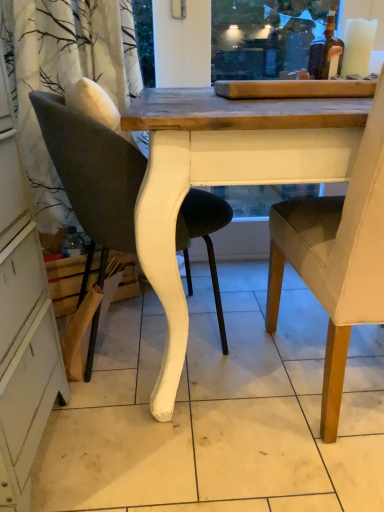
Image resolution: width=384 pixels, height=512 pixels. Describe the element at coordinates (93, 176) in the screenshot. I see `white painted wood chair at left, which is the 1th chair in left-to-right order` at that location.

What is the approximate height of white painted wood chair at left, which is the 1th chair in left-to-right order?

white painted wood chair at left, which is the 1th chair in left-to-right order, is 34.23 inches in height.

At what (x,y) coordinates should I click in order to perform the action: click on white painted wood chair at left, which is the 1th chair in left-to-right order. Please return your answer as a coordinate pair (x, y). Image resolution: width=384 pixels, height=512 pixels. Looking at the image, I should click on (93, 176).

In order to face light brown fabric chair at right, the 2th chair in the left-to-right sequence, should I rotate leftwards or rightwards?

Rotate your view right by about 23.432°.

This screenshot has height=512, width=384. I want to click on light brown fabric chair at right, which is the 1th chair in right-to-left order, so (337, 256).

What do you see at coordinates (337, 256) in the screenshot? Image resolution: width=384 pixels, height=512 pixels. I see `light brown fabric chair at right, which is the 1th chair in right-to-left order` at bounding box center [337, 256].

I want to click on white painted wood chair at left, which is the 1th chair in left-to-right order, so click(x=93, y=176).

Is light brown fabric chair at right, which is the 1th chair in right-to-left order, to the left of white painted wood chair at left, the 2th chair viewed from the right, from the viewer's perspective?

No, light brown fabric chair at right, which is the 1th chair in right-to-left order, is not to the left of white painted wood chair at left, the 2th chair viewed from the right.

In the scene shown: Between light brown fabric chair at right, which is the 1th chair in right-to-left order, and white painted wood chair at left, the 2th chair viewed from the right, which one is positioned behind?

white painted wood chair at left, the 2th chair viewed from the right, is more distant.

Between point (376, 159) and point (114, 145), which one is positioned behind?

The point (114, 145) is behind.

From the image's perspective, would you say light brown fabric chair at right, the 2th chair in the left-to-right sequence, is shown under white painted wood chair at left, the 2th chair viewed from the right?

Yes, from the image's perspective, light brown fabric chair at right, the 2th chair in the left-to-right sequence, is below white painted wood chair at left, the 2th chair viewed from the right.

From a real-world perspective, is light brown fabric chair at right, the 2th chair in the left-to-right sequence, on top of white painted wood chair at left, the 2th chair viewed from the right?

Yes.

Is light brown fabric chair at right, the 2th chair in the left-to-right sequence, thinner than white painted wood chair at left, which is the 1th chair in left-to-right order?

No.

Can you confirm if light brown fabric chair at right, which is the 1th chair in right-to-left order, is shorter than white painted wood chair at left, the 2th chair viewed from the right?

No, light brown fabric chair at right, which is the 1th chair in right-to-left order, is not shorter than white painted wood chair at left, the 2th chair viewed from the right.

Considering the sizes of objects light brown fabric chair at right, which is the 1th chair in right-to-left order, and white painted wood chair at left, which is the 1th chair in left-to-right order, in the image provided, who is smaller, light brown fabric chair at right, which is the 1th chair in right-to-left order, or white painted wood chair at left, which is the 1th chair in left-to-right order,?

white painted wood chair at left, which is the 1th chair in left-to-right order, is smaller.

Consider the image. Would you say white painted wood chair at left, which is the 1th chair in left-to-right order, is part of light brown fabric chair at right, the 2th chair in the left-to-right sequence,'s contents?

No, white painted wood chair at left, which is the 1th chair in left-to-right order, is located outside of light brown fabric chair at right, the 2th chair in the left-to-right sequence.

Is light brown fabric chair at right, the 2th chair in the left-to-right sequence, directly adjacent to white painted wood chair at left, which is the 1th chair in left-to-right order?

No.

In the scene shown: Is light brown fabric chair at right, the 2th chair in the left-to-right sequence, looking in the opposite direction of white painted wood chair at left, the 2th chair viewed from the right?

No, light brown fabric chair at right, the 2th chair in the left-to-right sequence, is not facing away from white painted wood chair at left, the 2th chair viewed from the right.

How much distance is there between light brown fabric chair at right, the 2th chair in the left-to-right sequence, and white painted wood chair at left, the 2th chair viewed from the right?

44.32 centimeters.

Locate an element on the screen. chair lying behind the light brown fabric chair at right, which is the 1th chair in right-to-left order is located at coordinates (93, 176).

Would you say white painted wood chair at left, which is the 1th chair in left-to-right order, is to the left or to the right of light brown fabric chair at right, the 2th chair in the left-to-right sequence, in the picture?

In the image, white painted wood chair at left, which is the 1th chair in left-to-right order, appears on the left side of light brown fabric chair at right, the 2th chair in the left-to-right sequence.

Is the depth of white painted wood chair at left, the 2th chair viewed from the right, less than that of light brown fabric chair at right, the 2th chair in the left-to-right sequence?

No, it is not.

Is point (126, 237) in front of point (278, 234)?

Yes.

From the image's perspective, which is above, white painted wood chair at left, which is the 1th chair in left-to-right order, or light brown fabric chair at right, the 2th chair in the left-to-right sequence?

white painted wood chair at left, which is the 1th chair in left-to-right order.

From a real-world perspective, is white painted wood chair at left, the 2th chair viewed from the right, physically above light brown fabric chair at right, which is the 1th chair in right-to-left order?

No.

Between white painted wood chair at left, which is the 1th chair in left-to-right order, and light brown fabric chair at right, the 2th chair in the left-to-right sequence, which one has larger width?

light brown fabric chair at right, the 2th chair in the left-to-right sequence.

Between white painted wood chair at left, the 2th chair viewed from the right, and light brown fabric chair at right, which is the 1th chair in right-to-left order, which one has less height?

white painted wood chair at left, the 2th chair viewed from the right, is shorter.

Which of these two, white painted wood chair at left, which is the 1th chair in left-to-right order, or light brown fabric chair at right, the 2th chair in the left-to-right sequence, is smaller?

With smaller size is white painted wood chair at left, which is the 1th chair in left-to-right order.

Is white painted wood chair at left, the 2th chair viewed from the right, positioned beyond the bounds of light brown fabric chair at right, the 2th chair in the left-to-right sequence?

Yes, white painted wood chair at left, the 2th chair viewed from the right, is located beyond the bounds of light brown fabric chair at right, the 2th chair in the left-to-right sequence.

Are white painted wood chair at left, which is the 1th chair in left-to-right order, and light brown fabric chair at right, the 2th chair in the left-to-right sequence, located far from each other?

No, there isn't a large distance between white painted wood chair at left, which is the 1th chair in left-to-right order, and light brown fabric chair at right, the 2th chair in the left-to-right sequence.

Is white painted wood chair at left, the 2th chair viewed from the right, oriented towards light brown fabric chair at right, which is the 1th chair in right-to-left order?

Yes, white painted wood chair at left, the 2th chair viewed from the right, is turned towards light brown fabric chair at right, which is the 1th chair in right-to-left order.

Can you tell me how much white painted wood chair at left, which is the 1th chair in left-to-right order, and light brown fabric chair at right, the 2th chair in the left-to-right sequence, differ in facing direction?

There is a 90-degree angle between the facing directions of white painted wood chair at left, which is the 1th chair in left-to-right order, and light brown fabric chair at right, the 2th chair in the left-to-right sequence.

Where is `chair above the white painted wood chair at left, the 2th chair viewed from the right (from a real-world perspective)`? chair above the white painted wood chair at left, the 2th chair viewed from the right (from a real-world perspective) is located at coordinates (337, 256).

Where is `chair on the right side of white painted wood chair at left, which is the 1th chair in left-to-right order`? The height and width of the screenshot is (512, 384). chair on the right side of white painted wood chair at left, which is the 1th chair in left-to-right order is located at coordinates (337, 256).

The height and width of the screenshot is (512, 384). Identify the location of chair that appears behind the light brown fabric chair at right, the 2th chair in the left-to-right sequence. (93, 176).